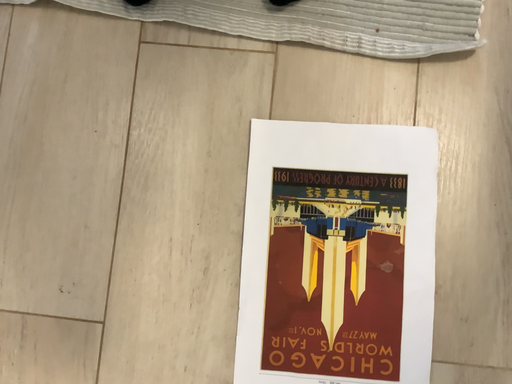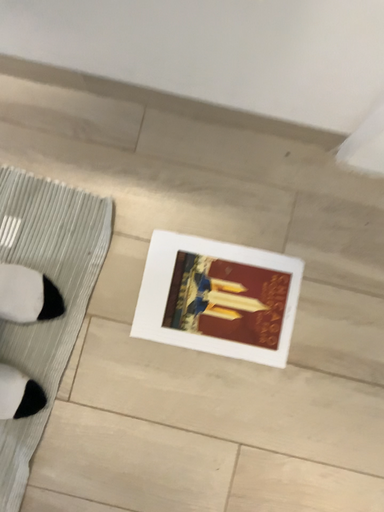
Question: How did the camera likely rotate when shooting the video?

Choices:
 (A) rotated upward
 (B) rotated downward

Answer: (A)